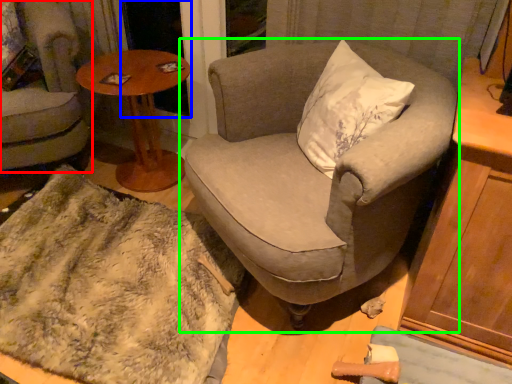
Question: Which object is positioned closest to chair (highlighted by a red box)? Select from screen door (highlighted by a blue box) and chair (highlighted by a green box).

Choices:
 (A) screen door
 (B) chair

Answer: (A)